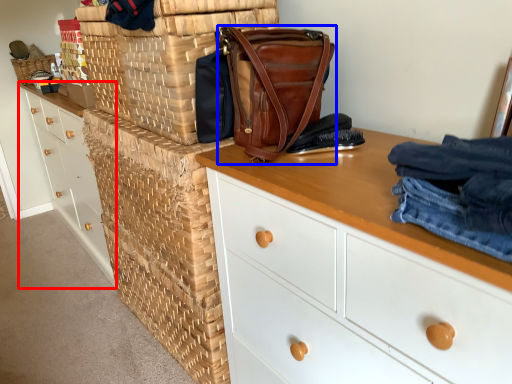
Question: Which object is closer to the camera taking this photo, chest of drawers (highlighted by a red box) or handbag (highlighted by a blue box)?

Choices:
 (A) chest of drawers
 (B) handbag

Answer: (B)